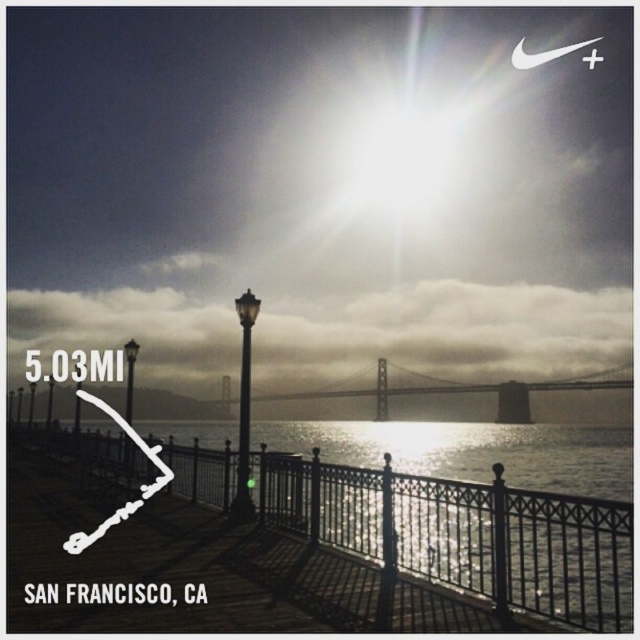
You are standing on the boardwalk and notice two objects ahead. The metallic black railing at lower center and the black glass lamp post at center. Which object is positioned to the right from your perspective?

The metallic black railing at lower center is positioned to the right of the black glass lamp post at center.

You are a tourist standing on the boardwalk and want to take a photo of the Bay Bridge. You notice the metallic black railing at lower center and the black glass pole at center. Which object is closer to you, the tourist?

The metallic black railing at lower center is closer to you because it is positioned in front of the black glass pole at center.